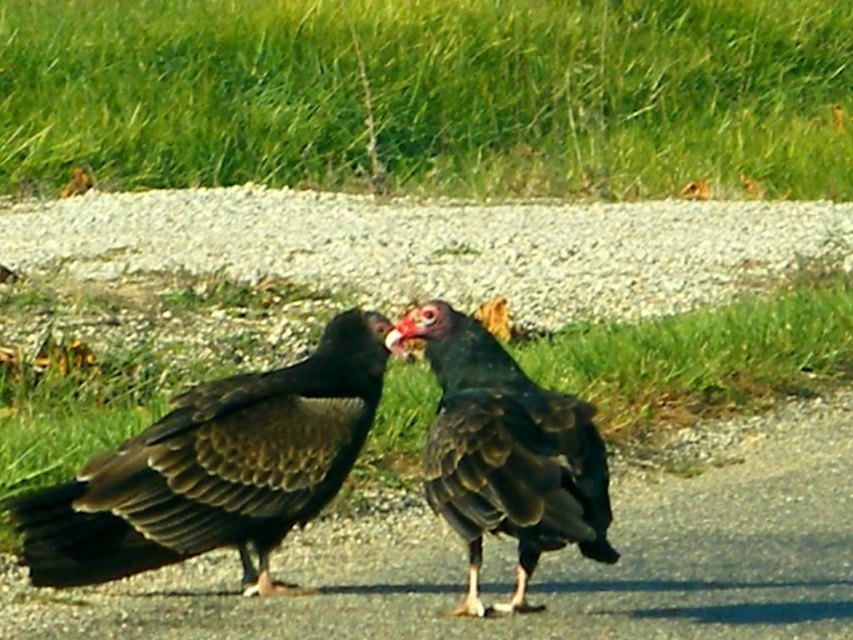
Does shiny black vulture at center come in front of bright red beak at center?

Yes, it is.

Describe the element at coordinates (508, 456) in the screenshot. I see `shiny black vulture at center` at that location.

Find the location of `shiny black vulture at center`. shiny black vulture at center is located at coordinates (508, 456).

Who is more forward, (x=346, y=320) or (x=425, y=461)?

Point (x=425, y=461) is more forward.

What do you see at coordinates (215, 468) in the screenshot?
I see `matte black vulture at center` at bounding box center [215, 468].

Where is `matte black vulture at center`? matte black vulture at center is located at coordinates (215, 468).

Does matte black vulture at center have a lesser height compared to bright red beak at center?

Incorrect, matte black vulture at center's height does not fall short of bright red beak at center's.

Is point (344, 358) behind point (397, 342)?

Yes.

Between point (300, 496) and point (387, 346), which one is positioned in front?

Point (300, 496) is more forward.

Locate an element on the screen. This screenshot has width=853, height=640. matte black vulture at center is located at coordinates (215, 468).